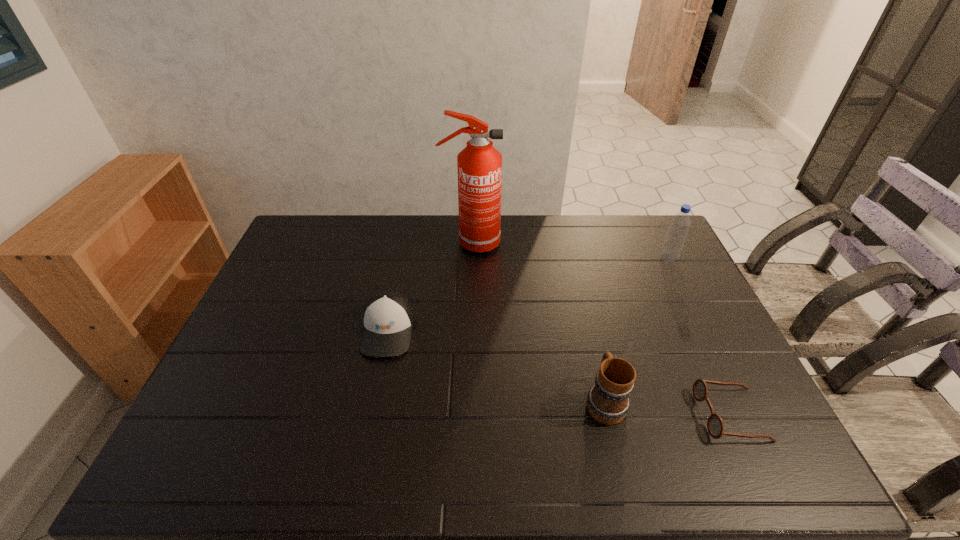
Identify which object is the nearest to the spectacles. Please provide its 2D coordinates. Your answer should be formatted as a tuple, i.e. [(x, y)], where the tuple contains the x and y coordinates of a point satisfying the conditions above.

[(608, 401)]

Image resolution: width=960 pixels, height=540 pixels. What are the coordinates of `vacant space that satisfies the following two spatial constraints: 1. at the nozzle of the bottle; 2. on the left side of the tallest object` in the screenshot? It's located at (470, 258).

Where is `vacant space that satisfies the following two spatial constraints: 1. at the nozzle of the tallest object; 2. on the front panel of the cap`? The width and height of the screenshot is (960, 540). vacant space that satisfies the following two spatial constraints: 1. at the nozzle of the tallest object; 2. on the front panel of the cap is located at coordinates click(x=469, y=330).

Find the location of a particular element. This screenshot has width=960, height=540. vacant space that satisfies the following two spatial constraints: 1. on the side of the third tallest object with the handle; 2. at the nozzle of the tallest object is located at coordinates (566, 244).

This screenshot has height=540, width=960. What are the coordinates of `vacant space that satisfies the following two spatial constraints: 1. at the nozzle of the fire extinguisher; 2. on the back side of the fourth shortest object` in the screenshot? It's located at (470, 258).

The image size is (960, 540). Identify the location of free space that satisfies the following two spatial constraints: 1. at the nozzle of the tallest object; 2. on the left side of the fourth shortest object. (470, 258).

At what (x,y) coordinates should I click in order to perform the action: click on vacant region that satisfies the following two spatial constraints: 1. at the nozzle of the fire extinguisher; 2. on the back side of the bottle. Please return your answer as a coordinate pair (x, y). Image resolution: width=960 pixels, height=540 pixels. Looking at the image, I should click on (470, 258).